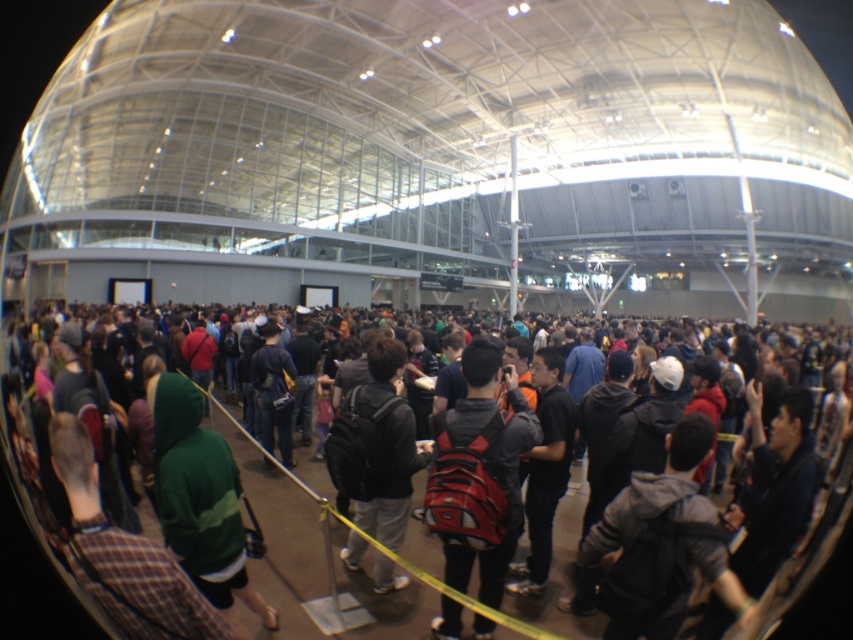
Is red backpack at center to the left of dark gray backpack at center from the viewer's perspective?

Incorrect, red backpack at center is not on the left side of dark gray backpack at center.

Is point (466, 349) less distant than point (383, 348)?

Yes.

Identify the location of red backpack at center. (479, 472).

I want to click on red backpack at center, so click(x=479, y=472).

The width and height of the screenshot is (853, 640). What do you see at coordinates (281, 536) in the screenshot? I see `dark green hoodie at center` at bounding box center [281, 536].

How distant is dark green hoodie at center from dark gray backpack at center?

A distance of 1.39 meters exists between dark green hoodie at center and dark gray backpack at center.

Between point (102, 620) and point (390, 372), which one is positioned behind?

The point (390, 372) is behind.

Where is `dark green hoodie at center`? Image resolution: width=853 pixels, height=640 pixels. dark green hoodie at center is located at coordinates (281, 536).

Is point (13, 465) farther from camera compared to point (509, 524)?

Yes, it is.

Which is in front, point (473, 596) or point (466, 481)?

Point (466, 481) is in front.

Which is in front, point (320, 540) or point (440, 618)?

Point (440, 618)

This screenshot has width=853, height=640. What are the coordinates of `dark green hoodie at center` in the screenshot? It's located at (281, 536).